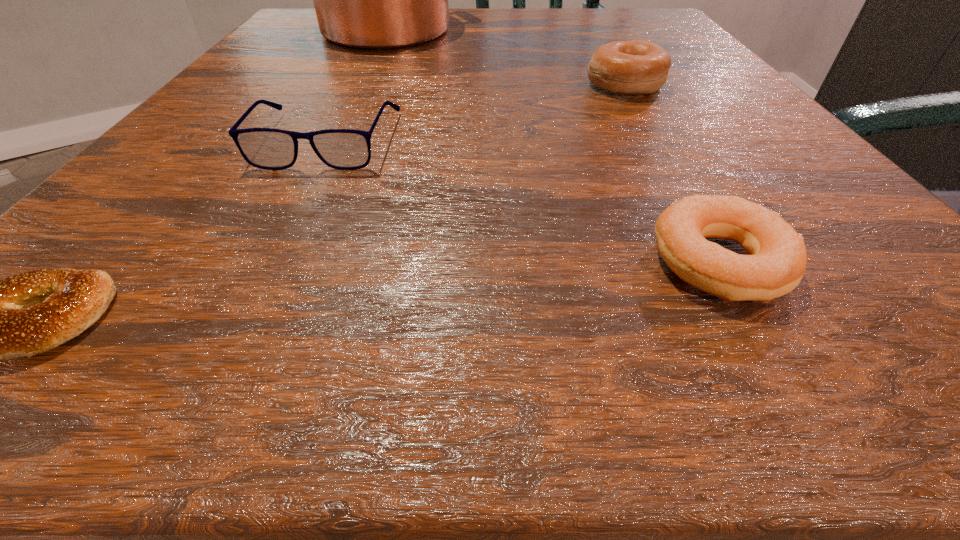
Locate which object ranks in proximity to the farthest bagel. Please provide its 2D coordinates. Your answer should be formatted as a tuple, i.e. [(x, y)], where the tuple contains the x and y coordinates of a point satisfying the conditions above.

[(370, 0)]

Point out which bagel is positioned as the second nearest to the second farthest object. Please provide its 2D coordinates. Your answer should be formatted as a tuple, i.e. [(x, y)], where the tuple contains the x and y coordinates of a point satisfying the conditions above.

[(28, 313)]

Find the location of a particular element. bagel object that ranks as the second closest to the second shortest bagel is located at coordinates (28, 313).

I want to click on free spot that satisfies the following two spatial constraints: 1. on the front-facing side of the second shortest object; 2. on the right side of the third nearest object, so click(x=267, y=263).